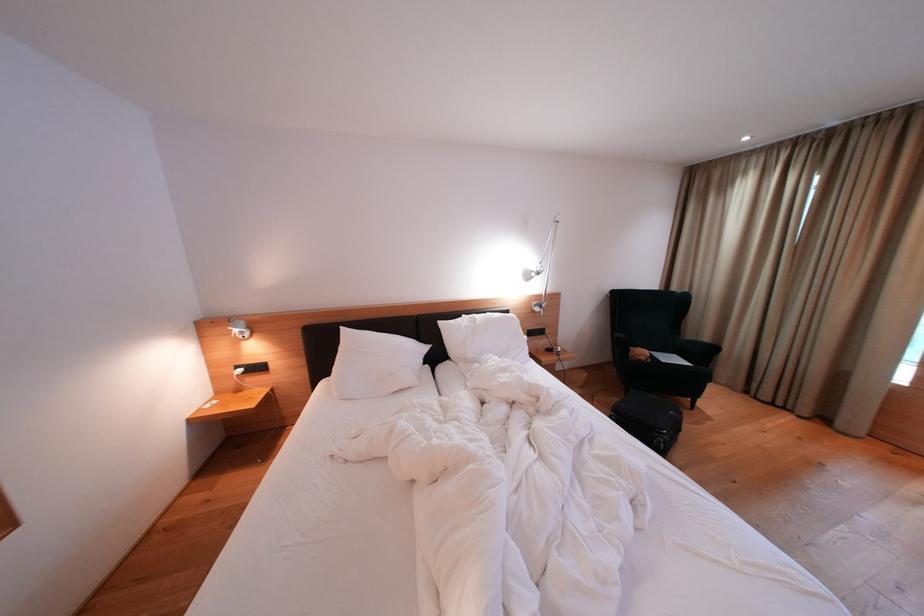
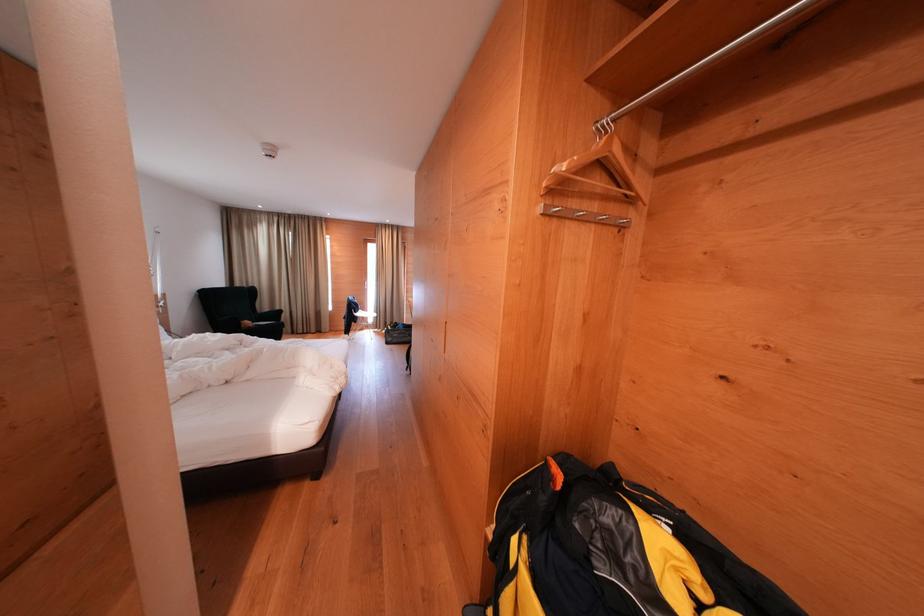
Locate, in the second image, the point that corresponds to (648,357) in the first image.

(254, 328)